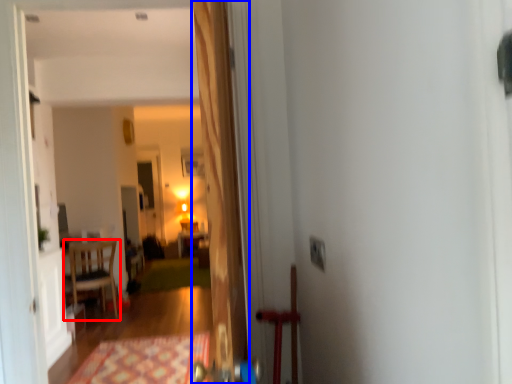
Question: Which object appears closest to the camera in this image, chair (highlighted by a red box) or door (highlighted by a blue box)?

Choices:
 (A) chair
 (B) door

Answer: (B)